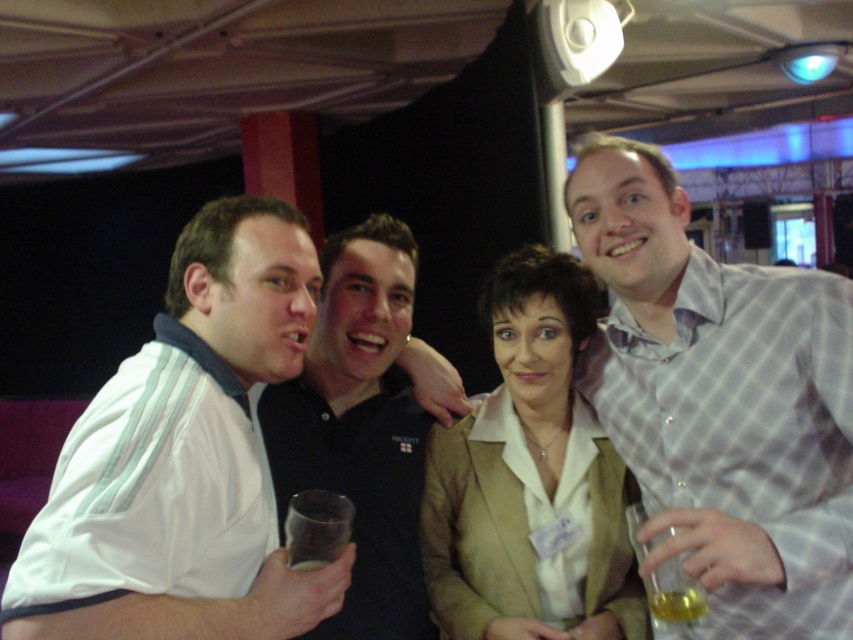
Question: Considering the relative positions of white fabric shirt at left and beige fabric jacket at center in the image provided, where is white fabric shirt at left located with respect to beige fabric jacket at center?

Choices:
 (A) above
 (B) below

Answer: (A)

Question: Considering the real-world distances, which object is closest to the white fabric shirt at left?

Choices:
 (A) light gray checkered shirt at upper right
 (B) beige fabric jacket at center
 (C) black matte shirt at center

Answer: (C)

Question: Is light gray checkered shirt at upper right further to camera compared to beige fabric jacket at center?

Choices:
 (A) yes
 (B) no

Answer: (B)

Question: Does light gray checkered shirt at upper right appear on the left side of beige fabric jacket at center?

Choices:
 (A) yes
 (B) no

Answer: (B)

Question: Which object is the closest to the black matte shirt at center?

Choices:
 (A) beige fabric jacket at center
 (B) white fabric shirt at left
 (C) light gray checkered shirt at upper right

Answer: (A)

Question: Which point appears farthest from the camera in this image?

Choices:
 (A) (630, 577)
 (B) (363, 538)
 (C) (68, 557)

Answer: (A)